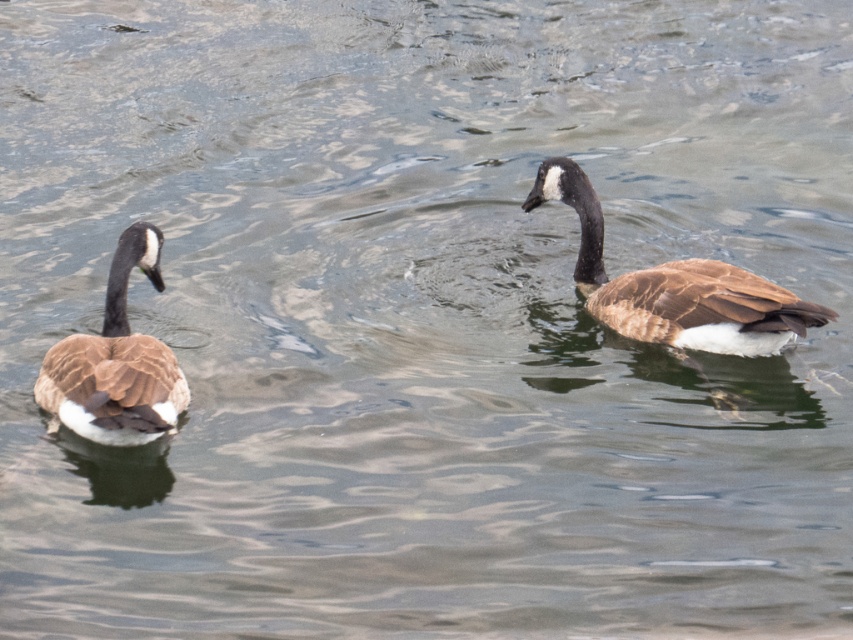
Does brown matte duck at right have a smaller size compared to brown matte duck at left?

No, brown matte duck at right is not smaller than brown matte duck at left.

Is point (682, 323) less distant than point (129, 388)?

That is False.

Identify the location of brown matte duck at right. (674, 285).